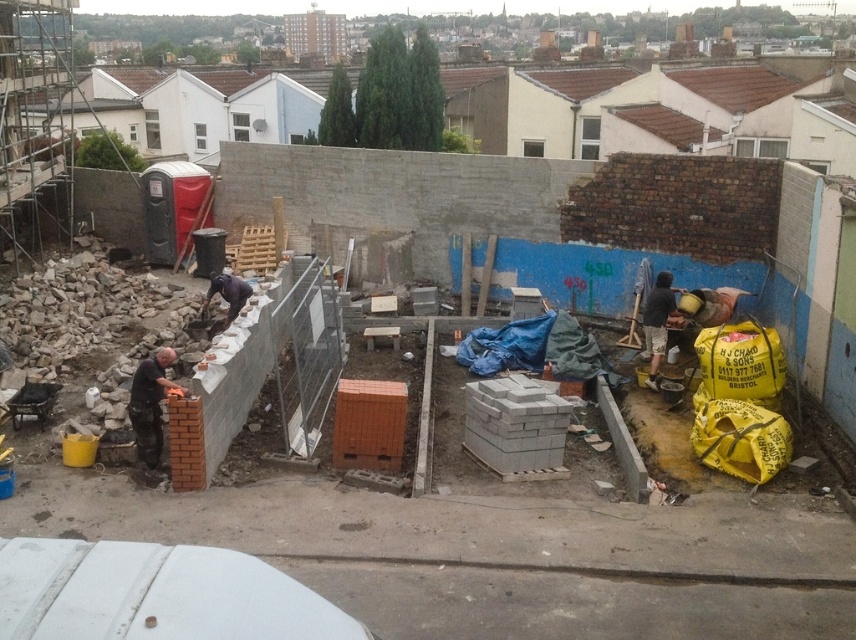
You are standing at the entrance of the construction site and notice two points marked on the ground. The first point is at coordinate point (x=176, y=387) and the second is at point (x=242, y=291). Which point is closer to you?

Point (x=176, y=387) is closer to the viewer than point (x=242, y=291).

You are a safety inspector on a construction site. You need to walk from the dark gray fabric shirt at right to the dark brown leather jacket at center. What is the minimum distance you must walk?

The minimum distance you must walk is 6.49 meters between dark gray fabric shirt at right and dark brown leather jacket at center.